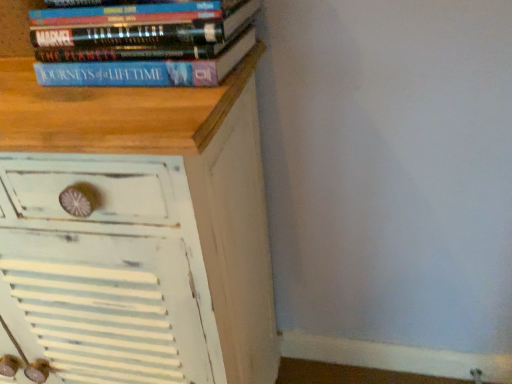
Question: Which is correct: blue matte book at upper left is inside white distressed wood chest of drawers at upper left, or outside of it?

Choices:
 (A) inside
 (B) outside

Answer: (B)

Question: Considering the positions of blue matte book at upper left and white distressed wood chest of drawers at upper left in the image, is blue matte book at upper left bigger or smaller than white distressed wood chest of drawers at upper left?

Choices:
 (A) small
 (B) big

Answer: (A)

Question: Is blue matte book at upper left in front of or behind white distressed wood chest of drawers at upper left in the image?

Choices:
 (A) front
 (B) behind

Answer: (B)

Question: Looking at their shapes, would you say white distressed wood chest of drawers at upper left is wider or thinner than blue matte book at upper left?

Choices:
 (A) thin
 (B) wide

Answer: (B)

Question: From a real-world perspective, relative to blue matte book at upper left, is white distressed wood chest of drawers at upper left vertically above or below?

Choices:
 (A) above
 (B) below

Answer: (B)

Question: Considering the positions of point (230, 289) and point (188, 51), is point (230, 289) closer or farther from the camera than point (188, 51)?

Choices:
 (A) farther
 (B) closer

Answer: (A)

Question: Looking at the image, does white distressed wood chest of drawers at upper left seem bigger or smaller compared to blue matte book at upper left?

Choices:
 (A) small
 (B) big

Answer: (B)